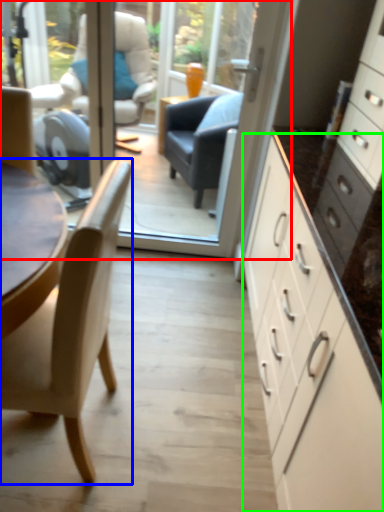
Question: Which is nearer to the glass door (highlighted by a red box)? chair (highlighted by a blue box) or cabinetry (highlighted by a green box).

Choices:
 (A) chair
 (B) cabinetry

Answer: (B)